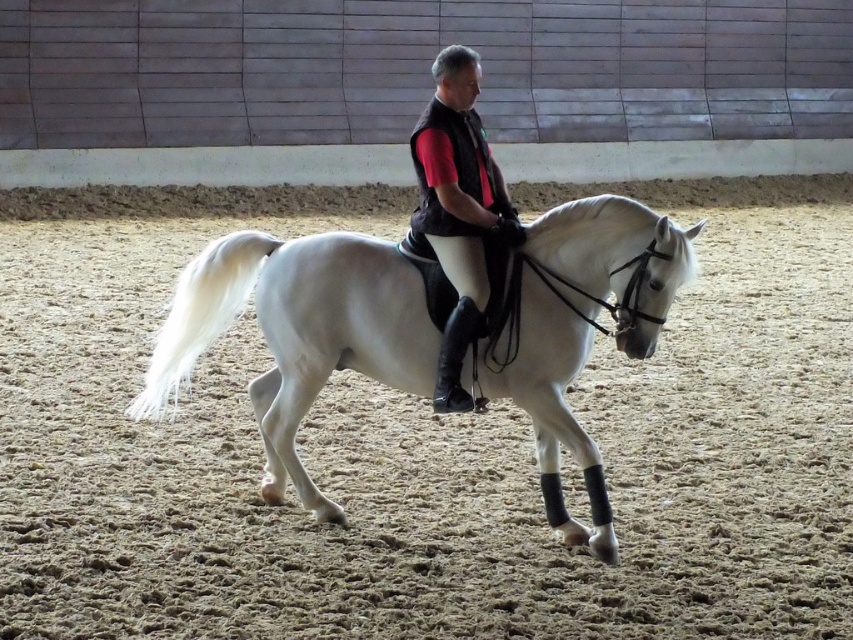
The image size is (853, 640). What do you see at coordinates (299, 332) in the screenshot?
I see `white glossy horse at center` at bounding box center [299, 332].

Can you confirm if white glossy horse at center is thinner than black matte vest at center?

No, white glossy horse at center is not thinner than black matte vest at center.

The width and height of the screenshot is (853, 640). In order to click on white glossy horse at center in this screenshot , I will do `click(299, 332)`.